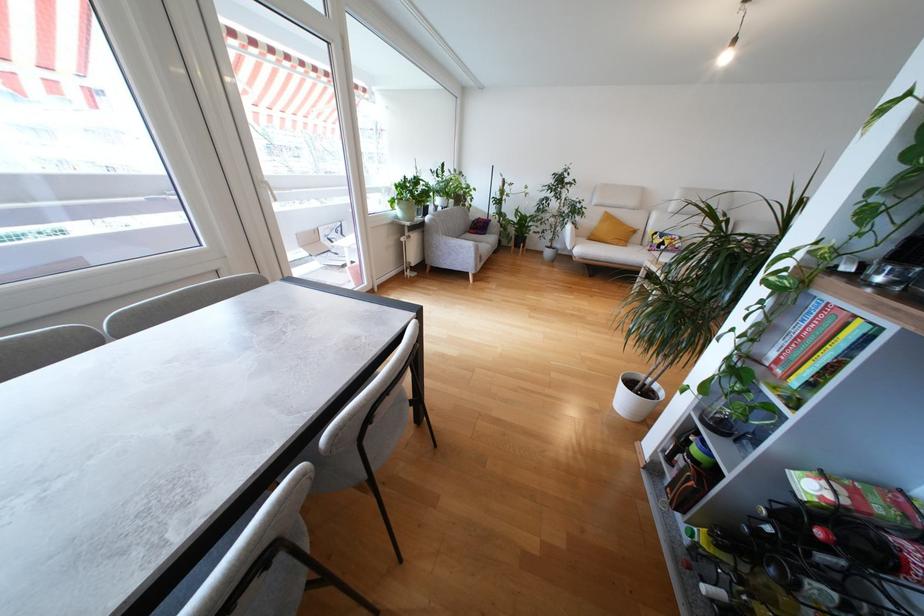
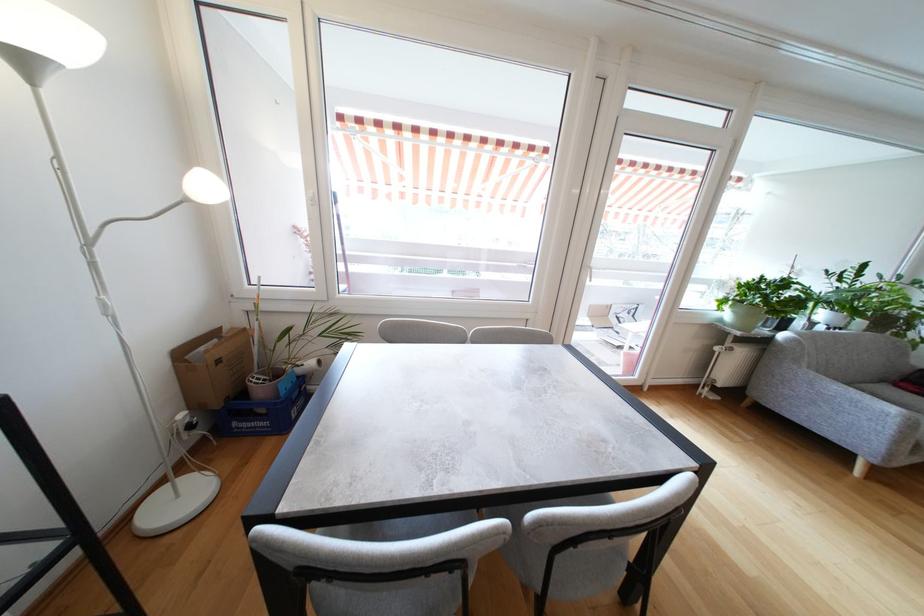
Where in the second image is the point corresponding to [400,204] from the first image?

(735, 305)